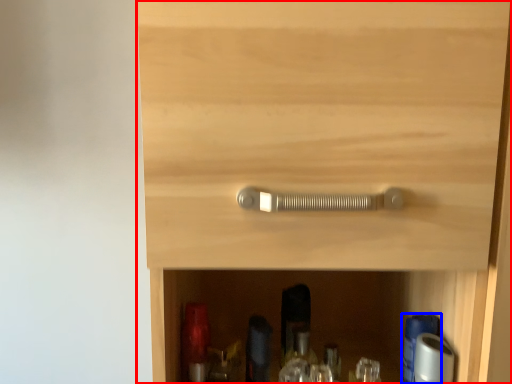
Question: Which object appears closest to the camera in this image, cupboard (highlighted by a red box) or bottle (highlighted by a blue box)?

Choices:
 (A) cupboard
 (B) bottle

Answer: (A)